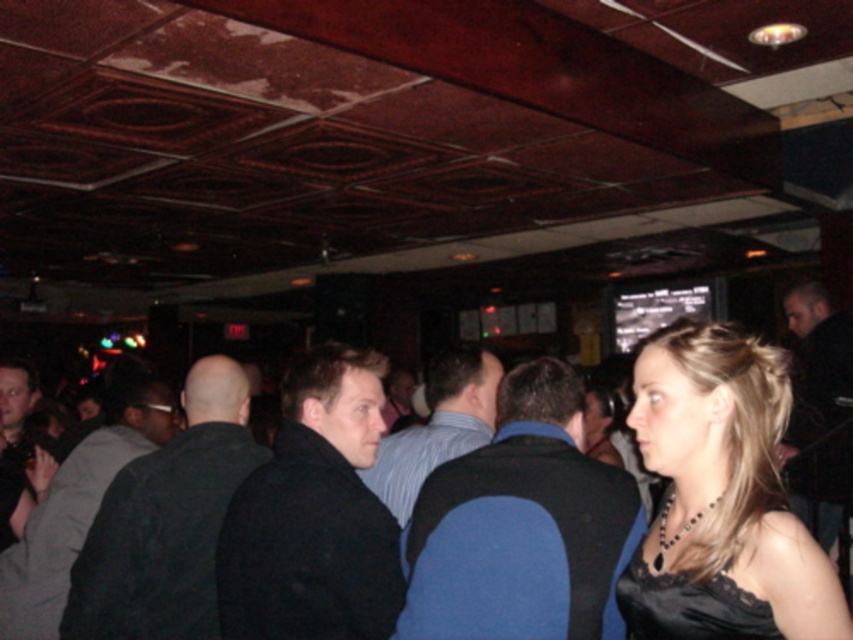
You are planning to wear both the dark gray vest at center and the black lace dress at lower right to an event. Which clothing item has a wider width?

The dark gray vest at center has a larger width than the black lace dress at lower right.

You are a photographer at a party and want to capture a photo of both the dark gray vest at center and the black lace dress at lower right in the same frame. The camera you are using has a maximum focus range of 1.5 meters. Can you include both subjects in the photo without moving the camera?

The dark gray vest at center is 1.68 meters away from the black lace dress at lower right, which exceeds the camera maximum focus range of 1.5 meters. So you cannot include both subjects in the photo without moving the camera.

You are at a party and need to decide which clothing item to take off first to stay cool. You have a dark blue shirt at center and a black matte vest at center. Which one should you remove first based on their thickness?

The dark blue shirt at center is thinner than the black matte vest at center, so removing the black matte vest at center first would help stay cooler as it is thicker and traps more heat.